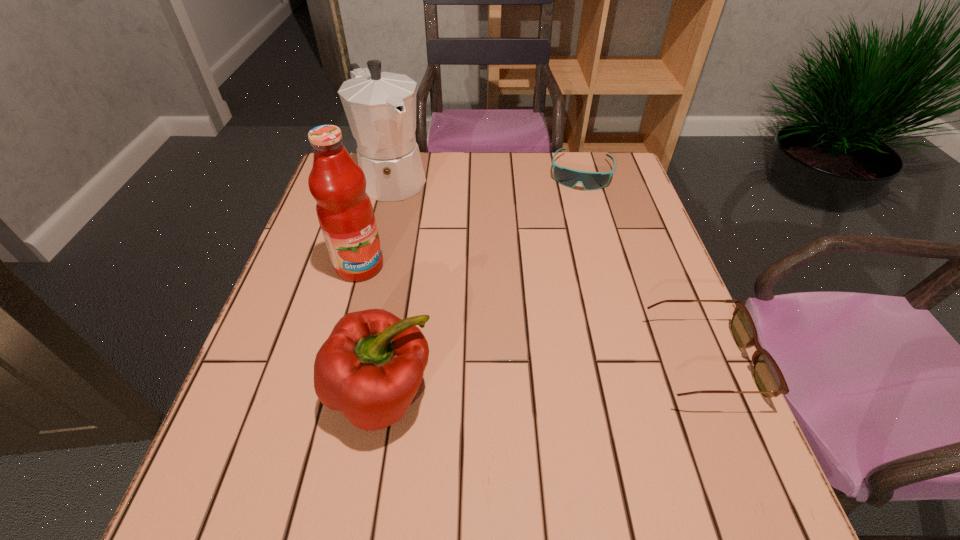
Locate an element on the screen. object that is the third closest to the third tallest object is located at coordinates (380, 107).

Image resolution: width=960 pixels, height=540 pixels. What are the coordinates of `object that ranks as the second closest to the sunglasses` in the screenshot? It's located at (767, 375).

Locate an element on the screen. The image size is (960, 540). free space that satisfies the following two spatial constraints: 1. on the front side of the fruit juice; 2. on the left side of the bell pepper is located at coordinates (325, 394).

Identify the location of free space that satisfies the following two spatial constraints: 1. on the front side of the fruit juice; 2. at the front view of the spectacles. tap(334, 362).

Locate an element on the screen. free space that satisfies the following two spatial constraints: 1. on the front side of the third shortest object; 2. on the right side of the third nearest object is located at coordinates (325, 394).

Find the location of a particular element. Image resolution: width=960 pixels, height=540 pixels. free point that satisfies the following two spatial constraints: 1. on the back side of the spectacles; 2. at the front view of the third shortest object is located at coordinates (388, 362).

Find the location of a particular element. The height and width of the screenshot is (540, 960). free location that satisfies the following two spatial constraints: 1. on the back side of the coffeepot; 2. on the right side of the third farthest object is located at coordinates (383, 178).

In order to click on vacant area in the image that satisfies the following two spatial constraints: 1. on the front side of the third nearest object; 2. at the front view of the spectacles in this screenshot , I will do `click(334, 362)`.

Where is `free space that satisfies the following two spatial constraints: 1. on the back side of the bell pepper; 2. on the left side of the shortest object`? free space that satisfies the following two spatial constraints: 1. on the back side of the bell pepper; 2. on the left side of the shortest object is located at coordinates (420, 172).